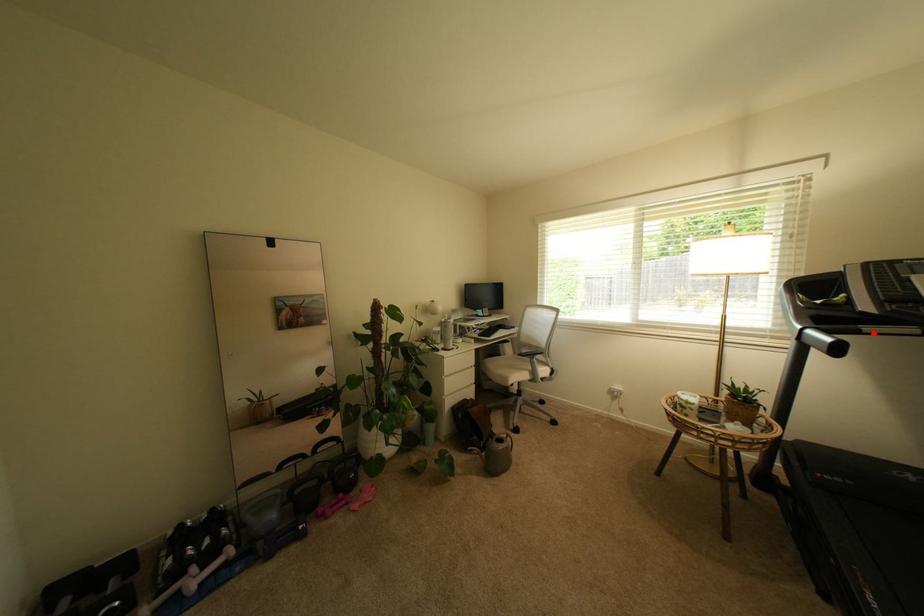
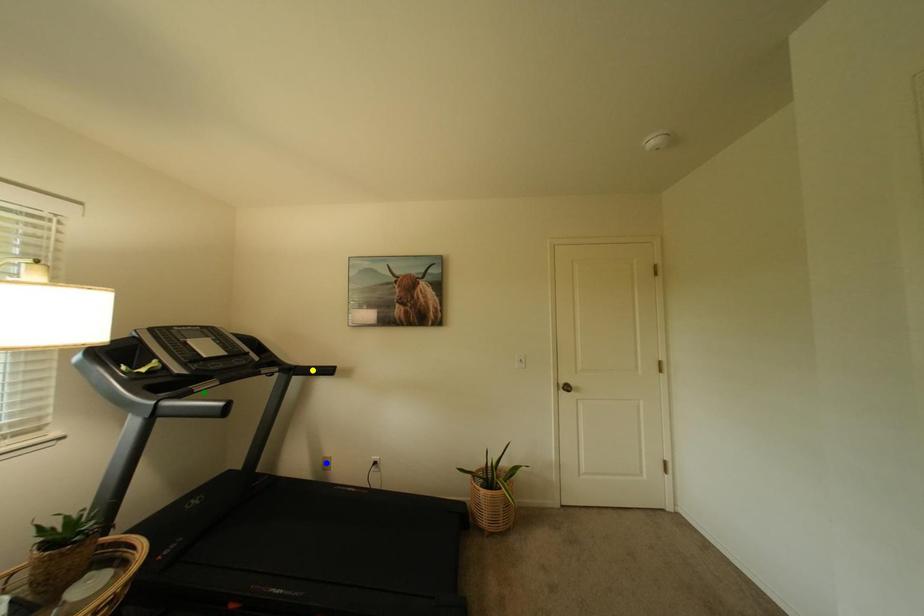
Question: I am providing you with two images of the same scene from different viewpoints. A red point is marked on the first image. You are given multiple points on the second image. Which point in image 2 represents the same 3d spot as the red point in image 1?

Choices:
 (A) yellow point
 (B) blue point
 (C) green point

Answer: (C)